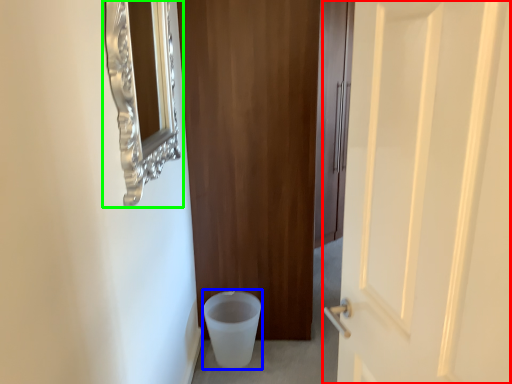
Question: Based on their relative distances, which object is nearer to door (highlighted by a red box)? Choose from potty (highlighted by a blue box) and medicine cabinet (highlighted by a green box).

Choices:
 (A) potty
 (B) medicine cabinet

Answer: (B)